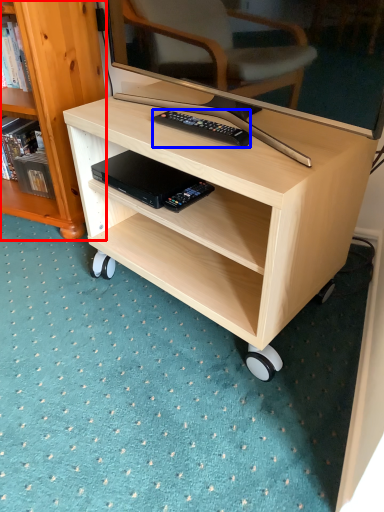
Question: Among these objects, which one is farthest to the camera, bookcase (highlighted by a red box) or remote control (highlighted by a blue box)?

Choices:
 (A) bookcase
 (B) remote control

Answer: (A)